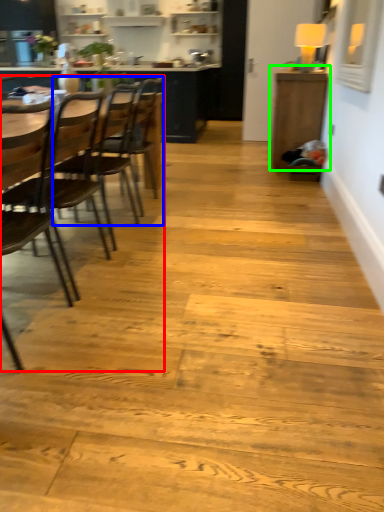
Question: Based on their relative distances, which object is farther from armchair (highlighted by a red box)? Choose from chair (highlighted by a blue box) and table (highlighted by a green box).

Choices:
 (A) chair
 (B) table

Answer: (B)